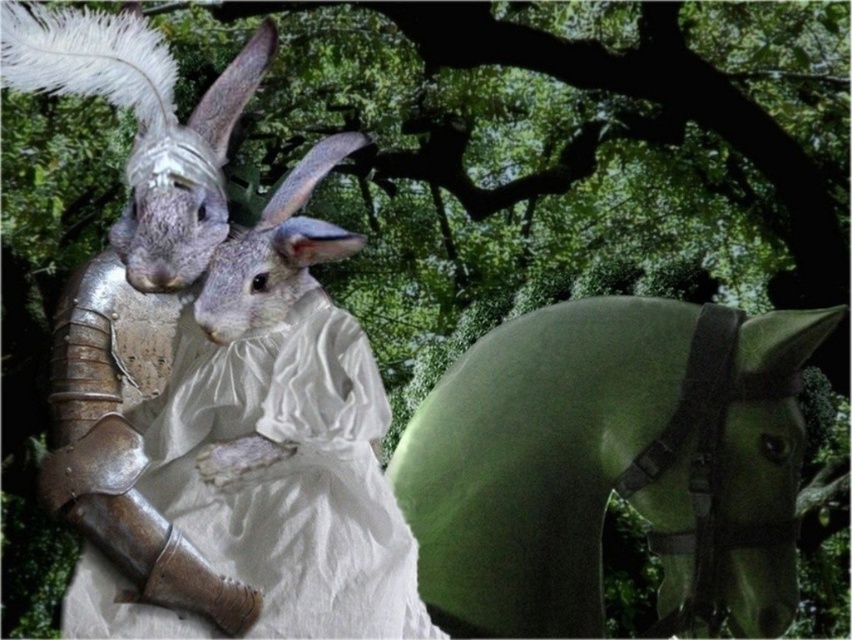
Based on the scene description, can you determine the spatial relationship between the green felt horse at right and the white satin dress at center?

The green felt horse at right is located above the white satin dress at center.